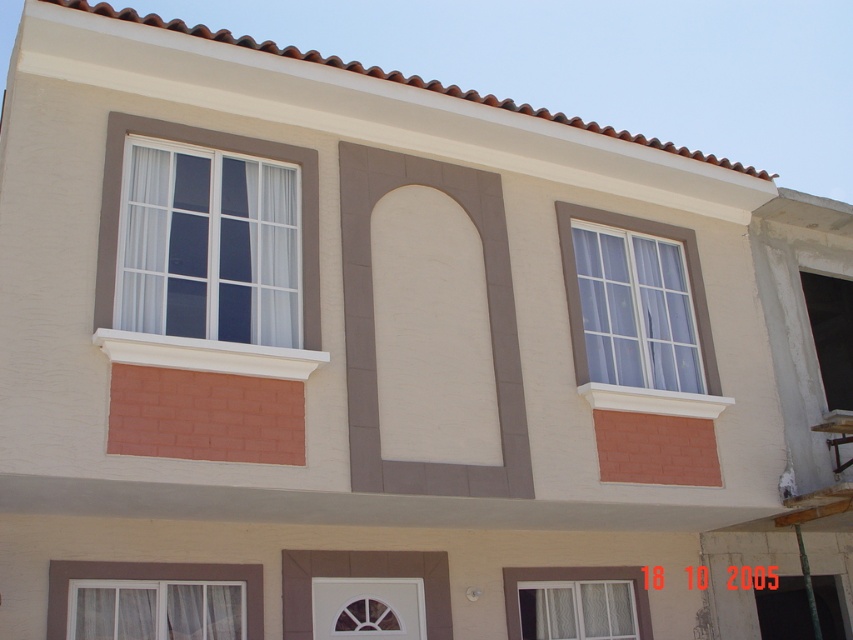
Does white glass window at lower center have a lesser width compared to white glass window at upper right?

Indeed, white glass window at lower center has a lesser width compared to white glass window at upper right.

Where is `white glass window at lower center`? Image resolution: width=853 pixels, height=640 pixels. white glass window at lower center is located at coordinates (367, 608).

You are a GUI agent. You are given a task and a screenshot of the screen. Output one action in this format:
    pyautogui.click(x=<x>, y=<y>)
    Task: Click on the white glass window at lower center
    The width and height of the screenshot is (853, 640).
    Given the screenshot: What is the action you would take?
    pyautogui.click(x=367, y=608)

Does white glass window at upper left come behind matte glass window at upper right?

No, white glass window at upper left is closer to the viewer.

Between point (256, 204) and point (822, 317), which one is positioned behind?

Positioned behind is point (822, 317).

Which is in front, point (137, 268) or point (830, 406)?

Point (137, 268)

Identify the location of white glass window at upper left. (209, 248).

Can you confirm if white textured window at lower right is positioned to the right of matte glass window at upper right?

In fact, white textured window at lower right is to the left of matte glass window at upper right.

Who is positioned more to the right, white textured window at lower right or matte glass window at upper right?

From the viewer's perspective, matte glass window at upper right appears more on the right side.

Which is in front, point (596, 620) or point (838, 337)?

Point (596, 620) is in front.

Image resolution: width=853 pixels, height=640 pixels. Find the location of `white textured window at lower right`. white textured window at lower right is located at coordinates (577, 609).